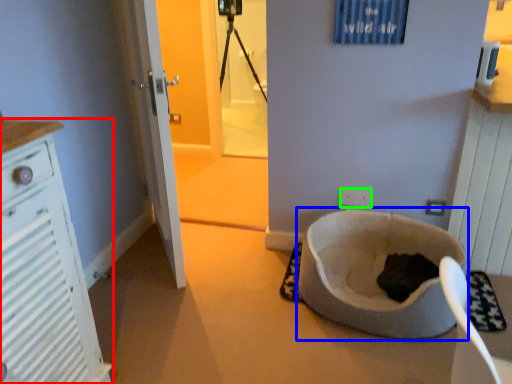
Question: Which object is the closest to the cabinetry (highlighted by a red box)? Choose among these: toilet bowl (highlighted by a blue box) or electric outlet (highlighted by a green box).

Choices:
 (A) toilet bowl
 (B) electric outlet

Answer: (A)